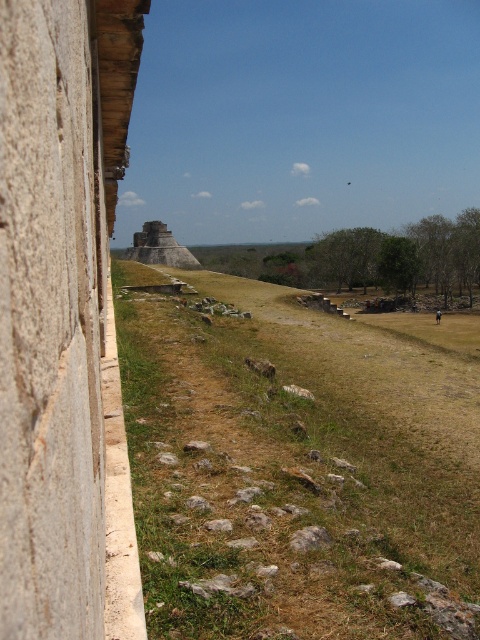
Between green grassy at center and smooth stone hut at left, which one is positioned lower?

green grassy at center

You are a GUI agent. You are given a task and a screenshot of the screen. Output one action in this format:
    pyautogui.click(x=<x>, y=<y>)
    Task: Click on the green grassy at center
    
    Given the screenshot: What is the action you would take?
    pyautogui.click(x=298, y=467)

Is smooth stone hut at left shorter than light brown stone pyramid at center?

Yes.

Looking at this image, who is more forward, (43, 3) or (156, 234)?

Point (43, 3)

Is point (23, 401) positioned in front of point (156, 234)?

That is True.

The image size is (480, 640). I want to click on smooth stone hut at left, so click(58, 298).

Who is lower down, green grassy at center or light brown stone pyramid at center?

green grassy at center is lower down.

Which of these two, green grassy at center or light brown stone pyramid at center, stands taller?

With more height is light brown stone pyramid at center.

From the picture: Who is more distant from viewer, (296, 588) or (139, 253)?

The point (139, 253) is behind.

Identify the location of green grassy at center. This screenshot has width=480, height=640. [298, 467].